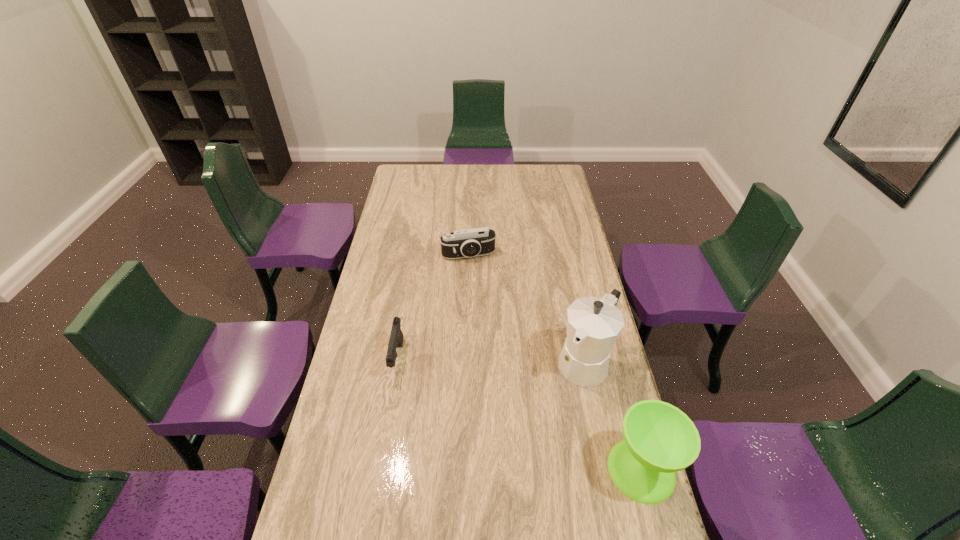
This screenshot has width=960, height=540. In the image, there is a desktop. In order to click on vacant space at the far left corner in this screenshot , I will do `click(412, 177)`.

Identify the location of empty location between the pistol and the second object from left to right. (433, 307).

Where is `free space that is in between the third shortest object and the camera`? free space that is in between the third shortest object and the camera is located at coordinates (555, 362).

Locate an element on the screen. free space between the farthest object and the coffeepot is located at coordinates click(x=527, y=308).

Identify the location of vacant space in between the camera and the coffeepot. (527, 308).

Where is `free spot between the pistol and the third shortest object`? The image size is (960, 540). free spot between the pistol and the third shortest object is located at coordinates (519, 414).

You are a GUI agent. You are given a task and a screenshot of the screen. Output one action in this format:
    pyautogui.click(x=<x>, y=<y>)
    Task: Click on the blank region between the leftmost object and the second object from left to right
    The width and height of the screenshot is (960, 540).
    Given the screenshot: What is the action you would take?
    (433, 307)

I want to click on unoccupied position between the second object from left to right and the nearest object, so click(555, 362).

What are the coordinates of `vacant space that's between the second tallest object and the farthest object` in the screenshot? It's located at (555, 362).

Find the location of a particular element. This screenshot has height=540, width=960. vacant area that lies between the third shortest object and the camera is located at coordinates (555, 362).